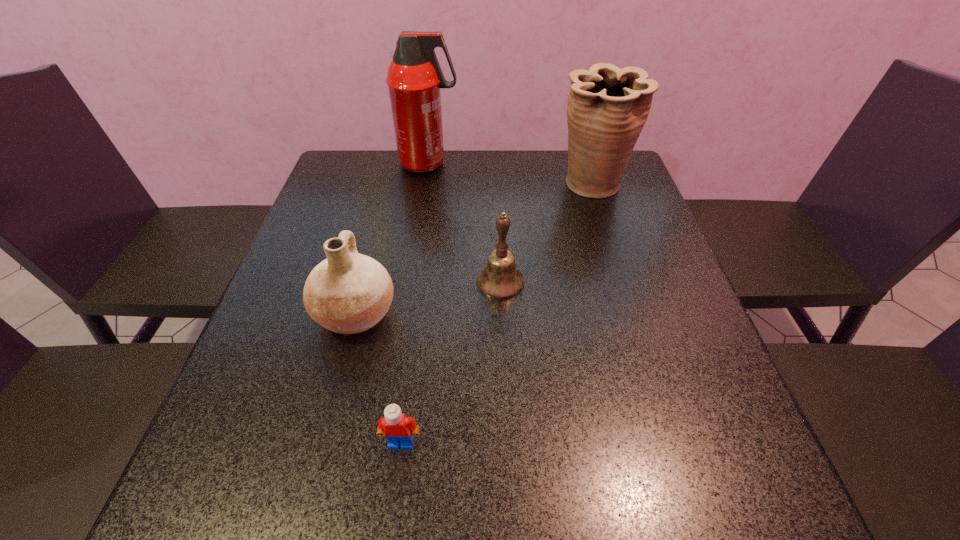
Locate an element on the screen. The image size is (960, 540). empty space that is in between the Lego and the urn is located at coordinates (496, 314).

Where is `free space between the pottery and the nearest object`? The image size is (960, 540). free space between the pottery and the nearest object is located at coordinates (378, 378).

This screenshot has height=540, width=960. In order to click on free space between the bell and the tallest object in this screenshot , I will do `click(465, 223)`.

The width and height of the screenshot is (960, 540). In order to click on the fourth closest object to the tallest object in this screenshot , I will do `click(395, 426)`.

You are a GUI agent. You are given a task and a screenshot of the screen. Output one action in this format:
    pyautogui.click(x=<x>, y=<y>)
    Task: Click on the object that can be found as the third closest to the rightmost object
    
    Given the screenshot: What is the action you would take?
    pyautogui.click(x=347, y=293)

Image resolution: width=960 pixels, height=540 pixels. Identify the location of free space that satisfies the following two spatial constraints: 1. on the trigger side of the rightmost object; 2. on the right side of the fire extinguisher. (425, 185).

The image size is (960, 540). Find the location of `vacant point that satisfies the following two spatial constraints: 1. on the back side of the second object from right to left; 2. on the trigger side of the fire extinguisher`. vacant point that satisfies the following two spatial constraints: 1. on the back side of the second object from right to left; 2. on the trigger side of the fire extinguisher is located at coordinates (495, 164).

Where is `vacant region that satisfies the following two spatial constraints: 1. on the trigger side of the fire extinguisher; 2. on the back side of the bell`? The height and width of the screenshot is (540, 960). vacant region that satisfies the following two spatial constraints: 1. on the trigger side of the fire extinguisher; 2. on the back side of the bell is located at coordinates (410, 282).

Locate an element on the screen. The width and height of the screenshot is (960, 540). free space that satisfies the following two spatial constraints: 1. on the front side of the fourth object from left to right; 2. to pour from the handle of the pottery is located at coordinates (502, 314).

Image resolution: width=960 pixels, height=540 pixels. What are the coordinates of `vacant point that satisfies the following two spatial constraints: 1. on the trigger side of the tallest object; 2. on the back side of the second tallest object` in the screenshot? It's located at (425, 185).